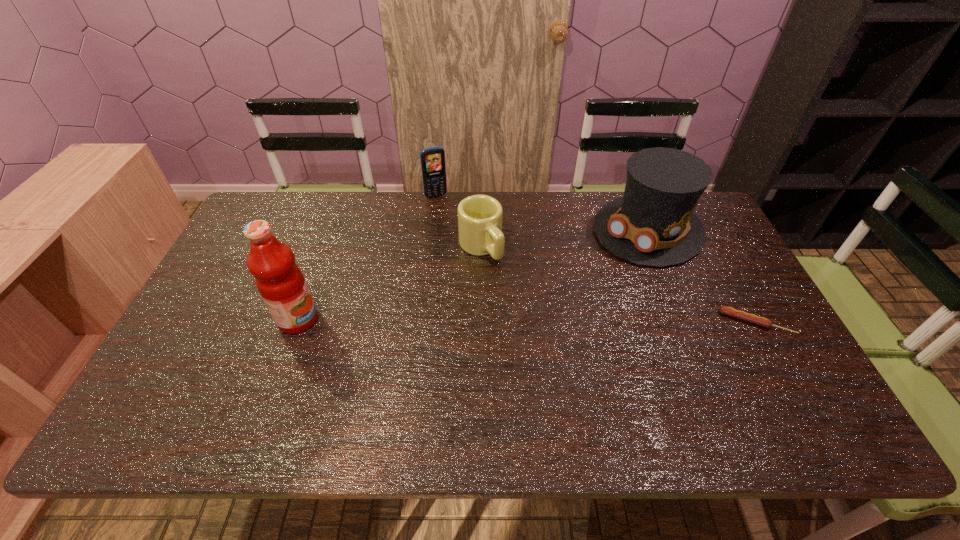
What are the coordinates of `free space located with goggles on the front of the second tallest object` in the screenshot? It's located at (549, 316).

Where is `vacant space positioned 0.280m with goggles on the front of the second tallest object`? This screenshot has width=960, height=540. vacant space positioned 0.280m with goggles on the front of the second tallest object is located at coordinates (561, 306).

The width and height of the screenshot is (960, 540). I want to click on free spot located with goggles on the front of the second tallest object, so click(571, 297).

The height and width of the screenshot is (540, 960). Identify the location of free space located with the handle on the side of the mug. (546, 329).

Image resolution: width=960 pixels, height=540 pixels. What are the coordinates of `free space located with the handle on the side of the mug` in the screenshot? It's located at (x=569, y=358).

The height and width of the screenshot is (540, 960). I want to click on vacant space located with the handle on the side of the mug, so (519, 297).

This screenshot has height=540, width=960. I want to click on vacant region located on the screen of the second object from left to right, so click(x=457, y=237).

Locate an element on the screen. free space located 0.160m on the screen of the second object from left to right is located at coordinates (452, 227).

Locate an element on the screen. Image resolution: width=960 pixels, height=540 pixels. vacant area situated on the screen of the second object from left to right is located at coordinates (458, 238).

Find the location of `dress hat positioned at the far edge`. dress hat positioned at the far edge is located at coordinates (653, 224).